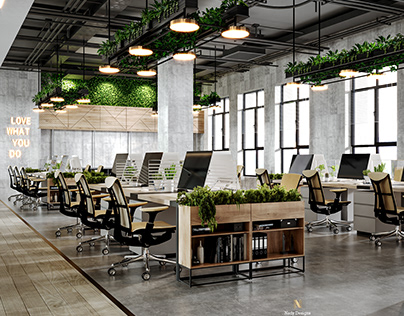
Where is `chair base`? chair base is located at coordinates (145, 252), (103, 239), (82, 225), (35, 199), (24, 198), (386, 232), (330, 220).